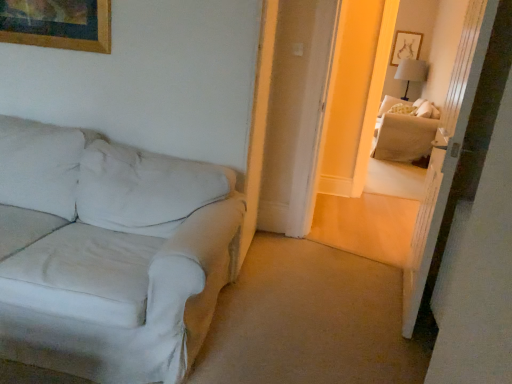
Question: Can you confirm if beige fabric couch at right is thinner than white fabric couch at left?

Choices:
 (A) no
 (B) yes

Answer: (B)

Question: From a real-world perspective, does beige fabric couch at right stand above white fabric couch at left?

Choices:
 (A) no
 (B) yes

Answer: (A)

Question: Considering the relative positions of beige fabric couch at right and white fabric couch at left in the image provided, is beige fabric couch at right in front of white fabric couch at left?

Choices:
 (A) yes
 (B) no

Answer: (B)

Question: Is white fabric couch at left a part of beige fabric couch at right?

Choices:
 (A) no
 (B) yes

Answer: (A)

Question: Is beige fabric couch at right beside white fabric couch at left?

Choices:
 (A) no
 (B) yes

Answer: (A)

Question: From the image's perspective, is beige fabric couch at right on top of white fabric couch at left?

Choices:
 (A) yes
 (B) no

Answer: (A)

Question: Is transparent glass door at upper right to the right of beige fabric couch at right from the viewer's perspective?

Choices:
 (A) no
 (B) yes

Answer: (A)

Question: From a real-world perspective, does transparent glass door at upper right sit lower than beige fabric couch at right?

Choices:
 (A) no
 (B) yes

Answer: (A)

Question: Is transparent glass door at upper right next to beige fabric couch at right and touching it?

Choices:
 (A) no
 (B) yes

Answer: (A)

Question: Can you confirm if transparent glass door at upper right is wider than beige fabric couch at right?

Choices:
 (A) yes
 (B) no

Answer: (B)

Question: Considering the relative sizes of transparent glass door at upper right and beige fabric couch at right in the image provided, is transparent glass door at upper right bigger than beige fabric couch at right?

Choices:
 (A) yes
 (B) no

Answer: (B)

Question: Can you confirm if transparent glass door at upper right is thinner than beige fabric couch at right?

Choices:
 (A) no
 (B) yes

Answer: (B)

Question: From a real-world perspective, is beige fabric couch at right positioned under transparent glass door at upper right based on gravity?

Choices:
 (A) no
 (B) yes

Answer: (B)